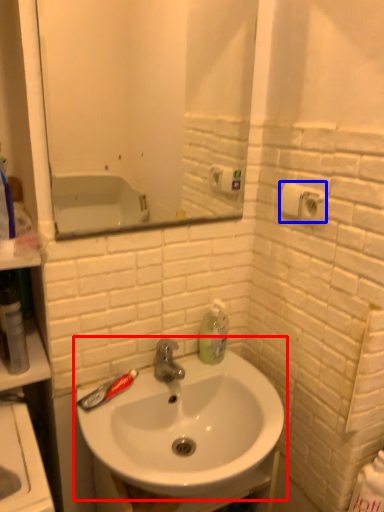
Question: Which of the following is the farthest to the observer, sink (highlighted by a red box) or toilet paper (highlighted by a blue box)?

Choices:
 (A) sink
 (B) toilet paper

Answer: (B)